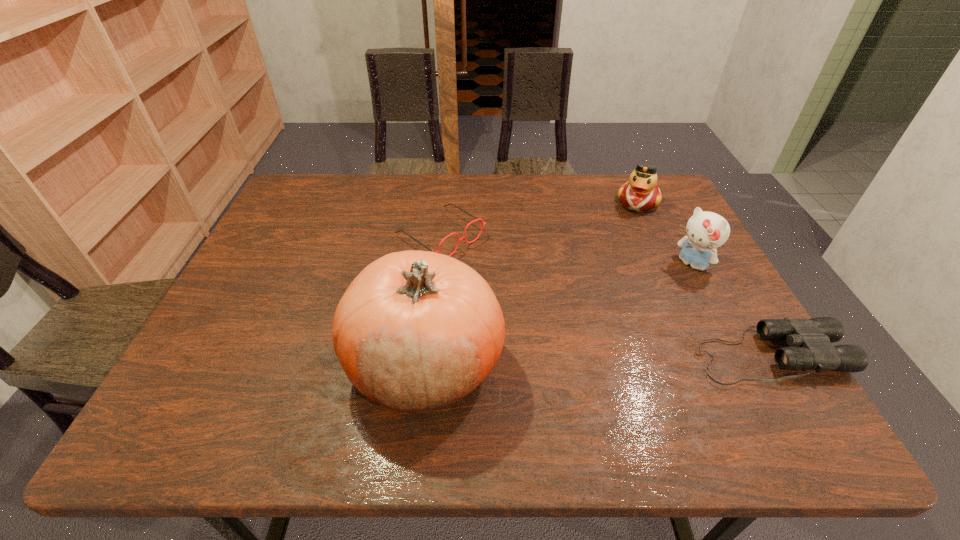
The height and width of the screenshot is (540, 960). I want to click on empty space between the binoculars and the tallest object, so click(597, 360).

In order to click on empty location between the pumpkin and the third shortest object in this screenshot , I will do `click(532, 283)`.

Locate an element on the screen. The height and width of the screenshot is (540, 960). free space between the kitten and the shortest object is located at coordinates pos(730,310).

Locate an element on the screen. The image size is (960, 540). vacant area that lies between the tallest object and the kitten is located at coordinates (559, 314).

Where is `vacant region between the binoculars and the pumpkin`? vacant region between the binoculars and the pumpkin is located at coordinates (597, 360).

Where is `free spot between the kitten and the tallest object`? The image size is (960, 540). free spot between the kitten and the tallest object is located at coordinates (559, 314).

Where is `free space between the third shortest object and the second shortest object`? free space between the third shortest object and the second shortest object is located at coordinates (540, 219).

Locate an element on the screen. The height and width of the screenshot is (540, 960). free spot between the fourth tallest object and the kitten is located at coordinates (565, 250).

I want to click on object that is the second closest to the pumpkin, so click(811, 339).

Point out which object is positioned as the nearest to the third tallest object. Please provide its 2D coordinates. Your answer should be formatted as a tuple, i.e. [(x, y)], where the tuple contains the x and y coordinates of a point satisfying the conditions above.

[(706, 231)]